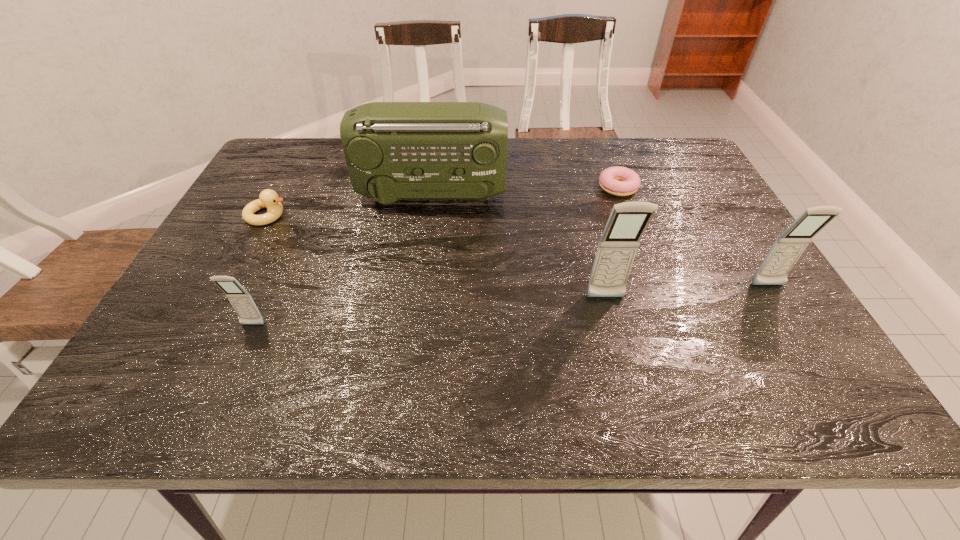
The height and width of the screenshot is (540, 960). Find the location of `free spot between the second shortest cellular telephone and the radio_receiver`. free spot between the second shortest cellular telephone and the radio_receiver is located at coordinates (x=600, y=240).

Where is `free space that is in between the second cellular telephone from right to left and the third object from left to right`? This screenshot has width=960, height=540. free space that is in between the second cellular telephone from right to left and the third object from left to right is located at coordinates (518, 246).

Locate an element on the screen. This screenshot has width=960, height=540. unoccupied position between the second object from left to right and the radio_receiver is located at coordinates (342, 260).

Identify the location of vacant region between the second shortest object and the fifth object from left to right. (443, 201).

Where is `empty space that is in between the shortest object and the nearest cellular telephone`? Image resolution: width=960 pixels, height=540 pixels. empty space that is in between the shortest object and the nearest cellular telephone is located at coordinates (435, 256).

Image resolution: width=960 pixels, height=540 pixels. Identify the location of free space between the radio_receiver and the second cellular telephone from right to left. (518, 246).

You are a GUI agent. You are given a task and a screenshot of the screen. Output one action in this format:
    pyautogui.click(x=<x>, y=<y>)
    Task: Click on the free spot between the second cellular telephone from left to right and the rightmost cellular telephone
    
    Given the screenshot: What is the action you would take?
    pyautogui.click(x=686, y=292)

At what (x,y) coordinates should I click in order to perform the action: click on unoccupied area between the second cellular telephone from left to right and the rightmost object. Please return your answer as a coordinate pair (x, y). Looking at the image, I should click on (686, 292).

This screenshot has width=960, height=540. Identify the location of free spot between the radio_receiver and the second shortest cellular telephone. (600, 240).

Identify the location of unoccupied position between the fifth object from left to right and the rightmost object. (693, 237).